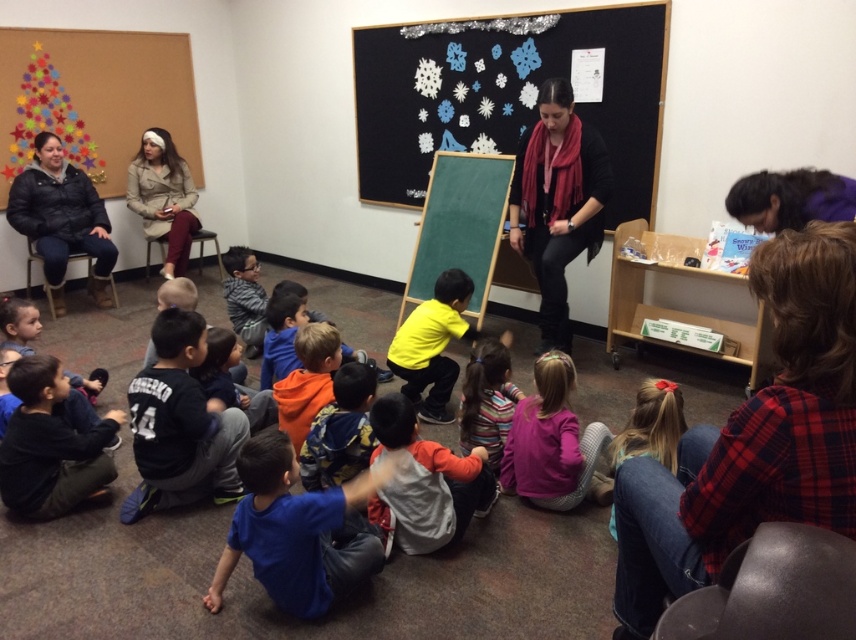
Who is more forward, (557,49) or (590,138)?

Point (590,138) is more forward.

Who is more distant from viewer, (464, 72) or (557, 234)?

The point (464, 72) is more distant.

Where is `blackboard with paper snowflakes at upper center`? This screenshot has height=640, width=856. blackboard with paper snowflakes at upper center is located at coordinates (503, 96).

Who is more distant from viewer, (530, 493) or (497, 428)?

The point (497, 428) is behind.

Does point (551, 497) come behind point (462, 444)?

No.

Identify the location of pink fleece jacket at center. The image size is (856, 640). (550, 440).

Is point (776, 240) in front of point (431, 390)?

Yes, point (776, 240) is in front of point (431, 390).

Is flannel shirt at lower right positioned at the back of yellow matte shirt at center?

No, it is not.

I want to click on flannel shirt at lower right, so click(x=753, y=438).